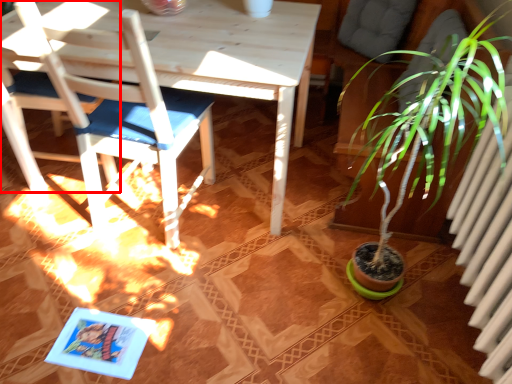
Question: Considering the relative positions of chair (annotated by the red box) and chair in the image provided, where is chair (annotated by the red box) located with respect to the staircase?

Choices:
 (A) left
 (B) right

Answer: (A)